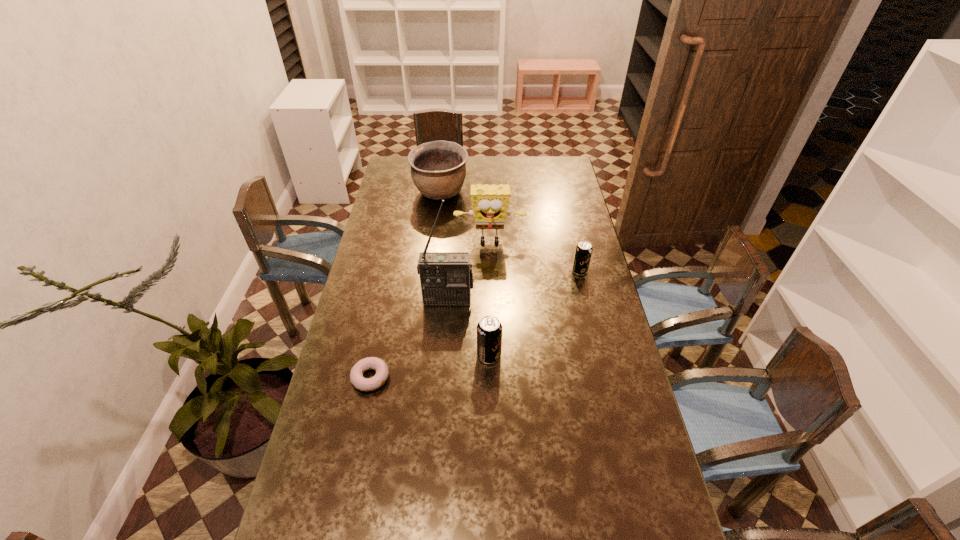
At what (x,y) coordinates should I click in order to perform the action: click on object that is at the right edge. Please return your answer as a coordinate pair (x, y). Looking at the image, I should click on (583, 252).

Where is `object located at the far left corner`? This screenshot has height=540, width=960. object located at the far left corner is located at coordinates (438, 169).

In the image, there is a desktop. At what (x,y) coordinates should I click in order to perform the action: click on free space at the far edge. Please return your answer as a coordinate pair (x, y). Looking at the image, I should click on (480, 178).

Where is `vacant space at the near edge`? vacant space at the near edge is located at coordinates (368, 524).

In the image, there is a desktop. Identify the location of free space at the left edge. This screenshot has height=540, width=960. (385, 232).

This screenshot has width=960, height=540. Find the location of `vacant space at the right edge of the desktop`. vacant space at the right edge of the desktop is located at coordinates (563, 278).

The height and width of the screenshot is (540, 960). In order to click on free space between the tallest object and the third shortest object in this screenshot , I will do `click(468, 327)`.

Where is `empty space between the doughnut and the left soda can`? The height and width of the screenshot is (540, 960). empty space between the doughnut and the left soda can is located at coordinates (430, 367).

Where is `vacant region between the doughnut and the third nearest object`? vacant region between the doughnut and the third nearest object is located at coordinates (409, 339).

Where is `vacant region between the farthest object and the fourth farthest object`? This screenshot has width=960, height=540. vacant region between the farthest object and the fourth farthest object is located at coordinates (444, 246).